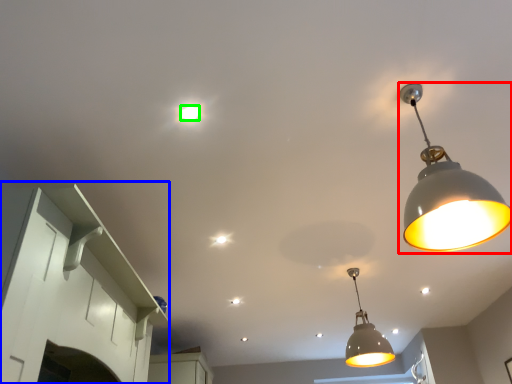
Question: Which object is positioned farthest from lamp (highlighted by a red box)? Select from cabinetry (highlighted by a blue box) and light bulb (highlighted by a green box).

Choices:
 (A) cabinetry
 (B) light bulb

Answer: (A)